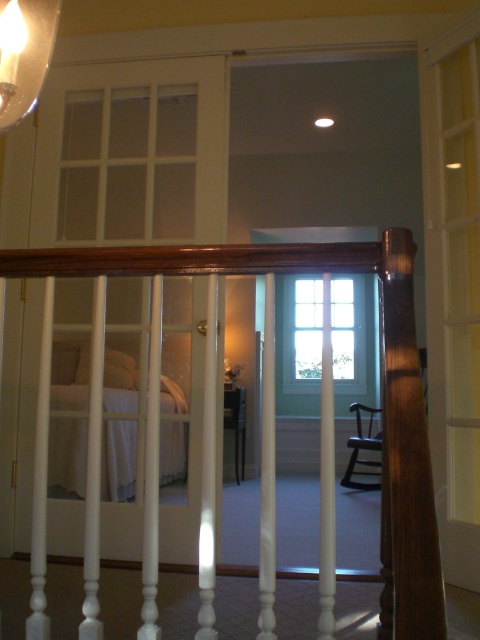
You are standing on the staircase and want to reach the bed in the room through the glass door. You notice the wooden handrail at center and the matte glass lampshade at upper left. Which object is taller?

The wooden handrail at center is much taller than the matte glass lampshade at upper left.